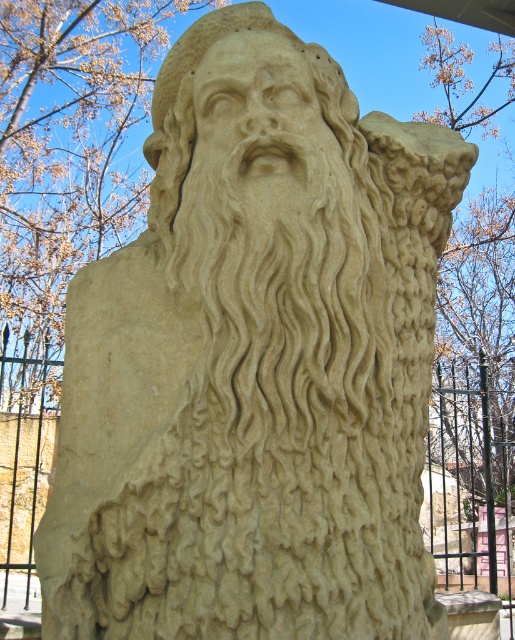
You are standing in front of the sand sculpture and want to take a photo of the black metal fence at upper center. Where exactly should you aim your camera to capture it?

You should aim your camera at point (468, 500) to capture the black metal fence at upper center.

You are standing in a park and see the beige stone head at center and the black metal fence at upper center. Which object is positioned higher in the image?

The beige stone head at center is positioned higher than the black metal fence at upper center because the fence is located below it.